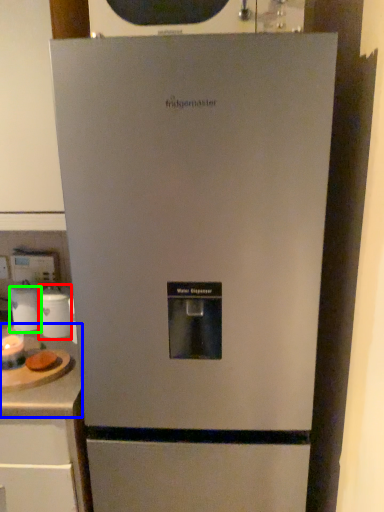
Question: Which object is the farthest from appliance (highlighted by a red box)? Choose among these: counter top (highlighted by a blue box) or appliance (highlighted by a green box).

Choices:
 (A) counter top
 (B) appliance

Answer: (A)